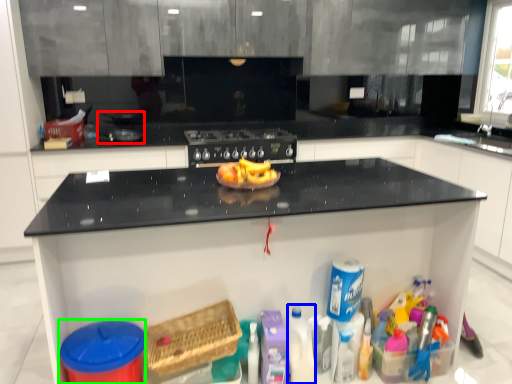
Question: Which is farther away from appliance (highlighted by a red box)? cleaning product (highlighted by a blue box) or appliance (highlighted by a green box)?

Choices:
 (A) cleaning product
 (B) appliance

Answer: (A)